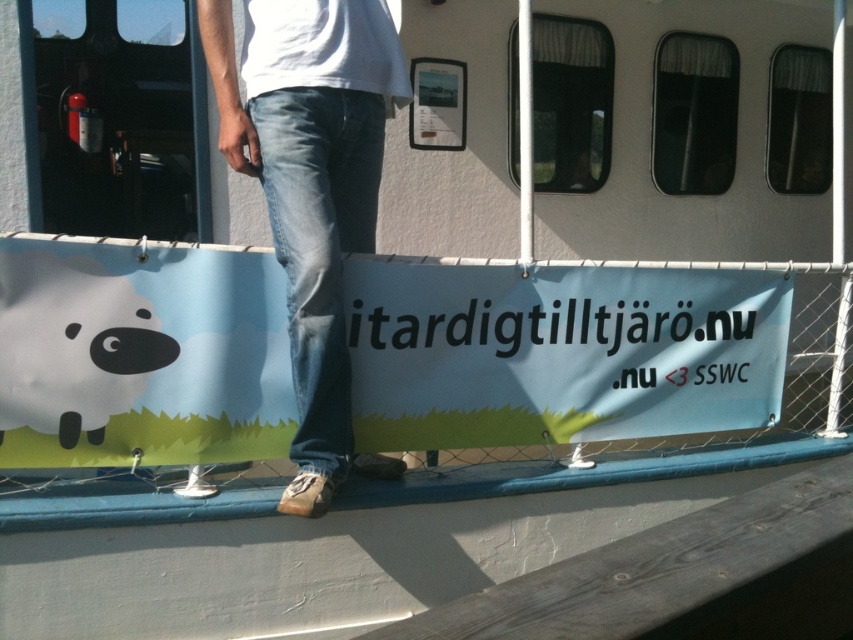
Looking at this image, you are a photographer trying to capture the banner on the boat. You notice the denim at center and the matte black sheep at lower left. Which object should you focus on first if you want to ensure both are in the frame without moving the camera?

You should focus on the denim at center first because it is positioned to the right of the matte black sheep at lower left, so centering the denim ensures the sheep remains within the frame.

You are trying to determine which object is wider between the denim at center and the matte black sheep at lower left. Based on the scene, which one is wider?

The matte black sheep at lower left is wider than the denim at center, as the denim at center is thinner than the matte black sheep at lower left.